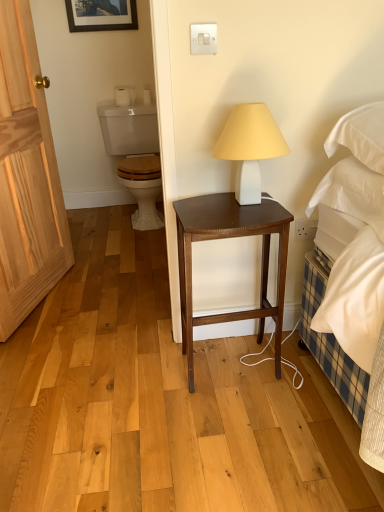
Question: Is white matte toilet paper at upper left shorter than white matte lamp at center?

Choices:
 (A) no
 (B) yes

Answer: (B)

Question: Considering the relative sizes of white matte toilet paper at upper left and white matte lamp at center in the image provided, is white matte toilet paper at upper left taller than white matte lamp at center?

Choices:
 (A) yes
 (B) no

Answer: (B)

Question: From the image's perspective, is white matte toilet paper at upper left located above white matte lamp at center?

Choices:
 (A) no
 (B) yes

Answer: (B)

Question: From a real-world perspective, does white matte toilet paper at upper left stand above white matte lamp at center?

Choices:
 (A) yes
 (B) no

Answer: (A)

Question: Can you confirm if white matte toilet paper at upper left is thinner than white matte lamp at center?

Choices:
 (A) no
 (B) yes

Answer: (B)

Question: Is natural wood door at left wider or thinner than white matte lamp at center?

Choices:
 (A) thin
 (B) wide

Answer: (A)

Question: Based on their positions, is natural wood door at left located to the left or right of white matte lamp at center?

Choices:
 (A) left
 (B) right

Answer: (A)

Question: Is natural wood door at left in front of or behind white matte lamp at center in the image?

Choices:
 (A) behind
 (B) front

Answer: (A)

Question: From the image's perspective, is natural wood door at left located above or below white matte lamp at center?

Choices:
 (A) above
 (B) below

Answer: (A)

Question: Is white soft pillow at right wider or thinner than white matte toilet paper at upper left?

Choices:
 (A) thin
 (B) wide

Answer: (B)

Question: From the image's perspective, is white soft pillow at right above or below white matte toilet paper at upper left?

Choices:
 (A) below
 (B) above

Answer: (A)

Question: Is white soft pillow at right bigger or smaller than white matte toilet paper at upper left?

Choices:
 (A) small
 (B) big

Answer: (B)

Question: In the image, is white soft pillow at right on the left side or the right side of white matte toilet paper at upper left?

Choices:
 (A) right
 (B) left

Answer: (A)

Question: From a real-world perspective, is white plastic power outlet at lower right positioned above or below white soft pillow at right?

Choices:
 (A) above
 (B) below

Answer: (B)

Question: Considering the positions of white plastic power outlet at lower right and white soft pillow at right in the image, is white plastic power outlet at lower right wider or thinner than white soft pillow at right?

Choices:
 (A) thin
 (B) wide

Answer: (A)